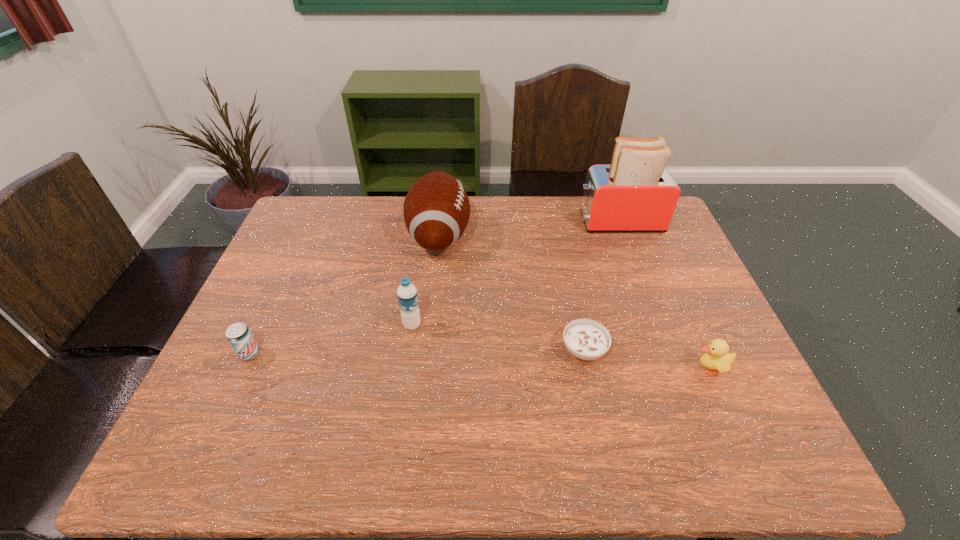
Identify the location of toaster. The image size is (960, 540). (635, 193).

Locate an element on the screen. football is located at coordinates (436, 209).

What are the coordinates of `water bottle` in the screenshot? It's located at (407, 295).

Identify the location of duckling. The width and height of the screenshot is (960, 540). (717, 358).

Image resolution: width=960 pixels, height=540 pixels. I want to click on beer can, so click(x=238, y=334).

Identify the location of the fourth object from left to right. (586, 339).

Locate an element on the screen. The image size is (960, 540). soup bowl is located at coordinates (586, 339).

Where is `free space located on the front-facing side of the tallest object`? free space located on the front-facing side of the tallest object is located at coordinates (490, 221).

Image resolution: width=960 pixels, height=540 pixels. I want to click on free spot located 0.220m on the front-facing side of the tallest object, so click(514, 221).

Identify the location of blank area located 0.070m on the front-facing side of the tallest object. The image size is (960, 540). (557, 221).